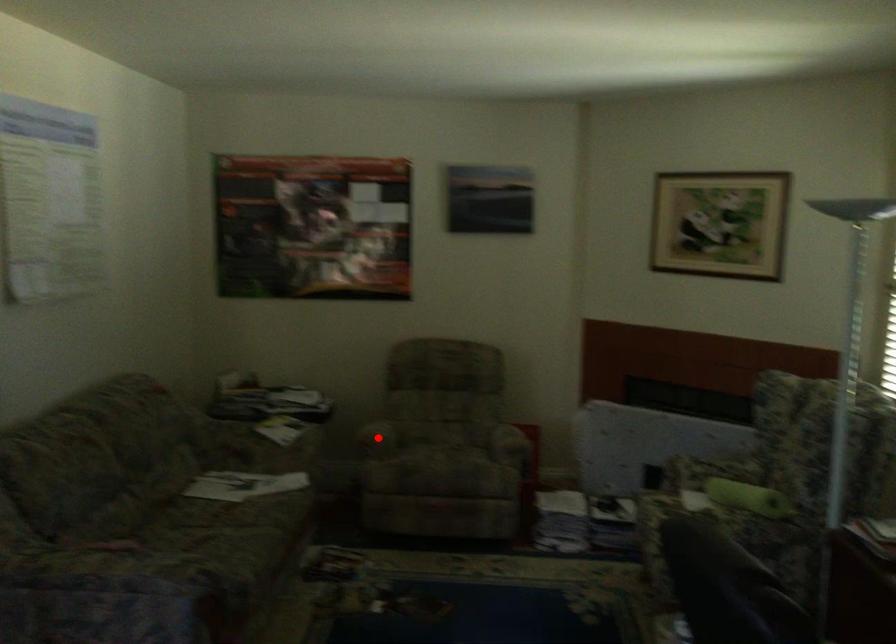
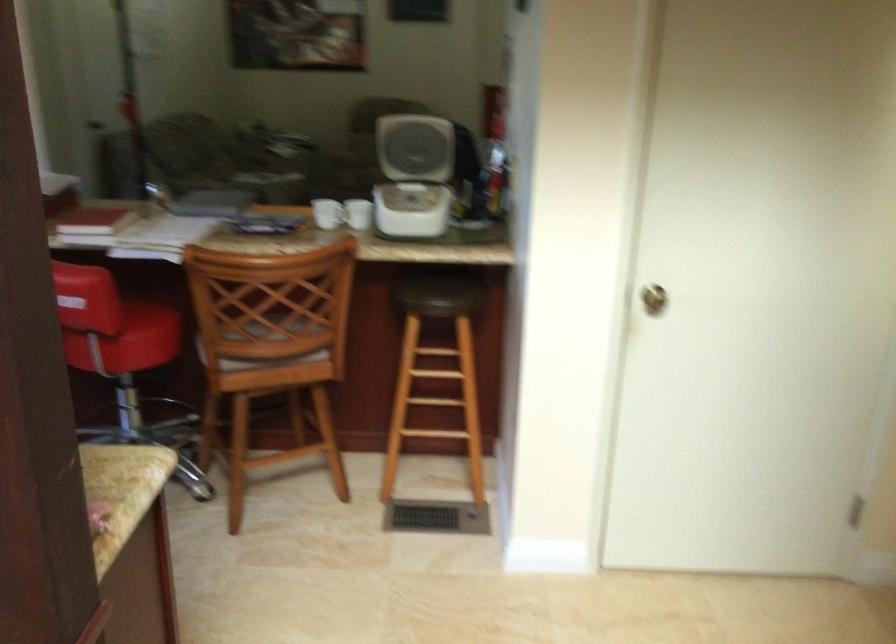
Question: I am providing you with two images of the same scene from different viewpoints. A red point is marked on the first image. At the location where the point appears in image 1, is it still visible in image 2?

Choices:
 (A) Yes
 (B) No

Answer: (B)